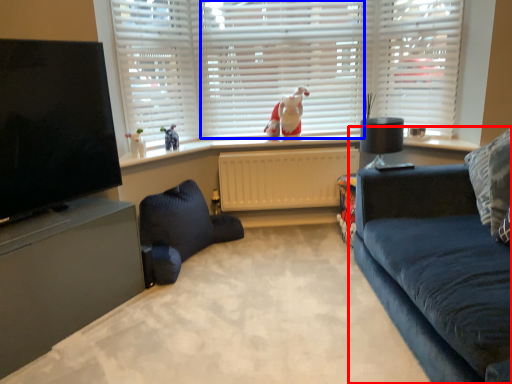
Question: Which point is further to the camera, studio couch (highlighted by a red box) or shutter (highlighted by a blue box)?

Choices:
 (A) studio couch
 (B) shutter

Answer: (B)